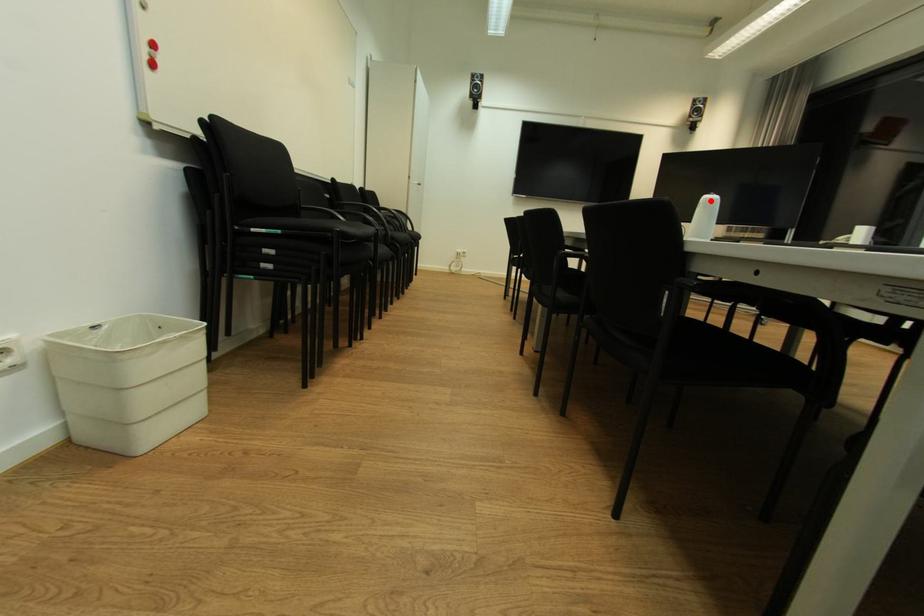
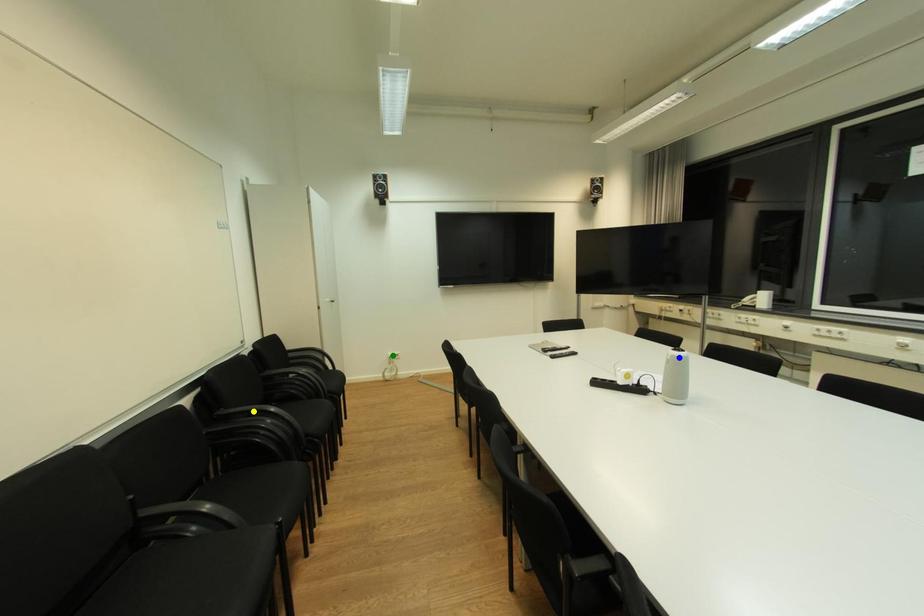
Question: I am providing you with two images of the same scene from different viewpoints. A red point is marked on the first image. You are given multiple points on the second image. Which point in image 2 represents the same 3d spot as the red point in image 1?

Choices:
 (A) yellow point
 (B) blue point
 (C) green point

Answer: (B)